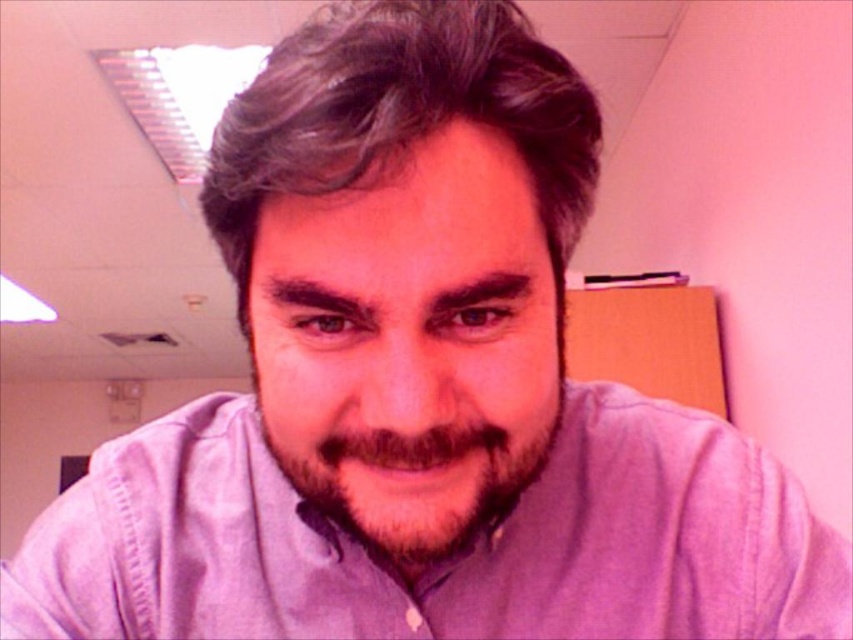
Question: Which point is closer to the camera?

Choices:
 (A) (514, 497)
 (B) (328, 74)

Answer: (B)

Question: Is the position of purple cotton shirt at center less distant than that of brown fuzzy beard at center?

Choices:
 (A) no
 (B) yes

Answer: (A)

Question: Is purple cotton shirt at center further to camera compared to gray matte hair at center?

Choices:
 (A) yes
 (B) no

Answer: (A)

Question: Which of these objects is positioned farthest from the brown fuzzy beard at center?

Choices:
 (A) purple cotton shirt at center
 (B) gray matte hair at center

Answer: (A)

Question: Among these objects, which one is farthest from the camera?

Choices:
 (A) gray matte hair at center
 (B) purple cotton shirt at center
 (C) brown fuzzy beard at center

Answer: (B)

Question: In this image, where is gray matte hair at center located relative to brown fuzzy beard at center?

Choices:
 (A) below
 (B) above

Answer: (B)